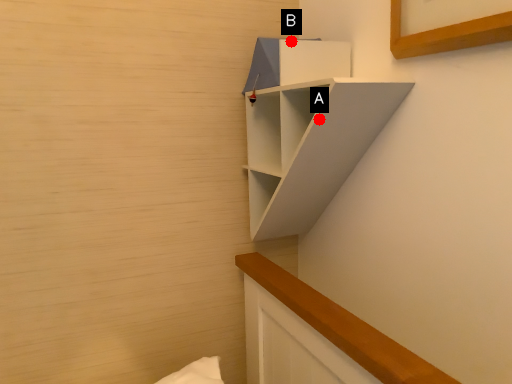
Question: Two points are circled on the image, labeled by A and B beside each circle. Which point is closer to the camera?

Choices:
 (A) A is closer
 (B) B is closer

Answer: (A)